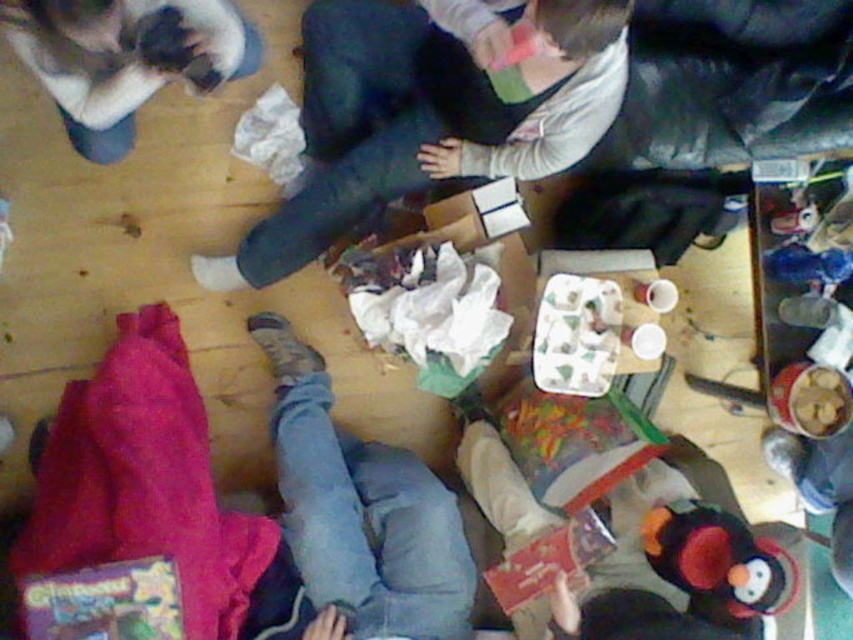
Question: Which point is farther to the camera?

Choices:
 (A) (239, 51)
 (B) (705, 556)
 (C) (527, 24)
 (D) (376, 564)

Answer: (D)

Question: Which object is positioned farthest from the jeans at center?

Choices:
 (A) fluffy plush penguin at lower right
 (B) dark blue jeans at center
 (C) fluffy white cat at upper left

Answer: (C)

Question: Is jeans at center to the left of fluffy white cat at upper left from the viewer's perspective?

Choices:
 (A) no
 (B) yes

Answer: (A)

Question: Which point is farther to the camera?

Choices:
 (A) (686, 561)
 (B) (352, 609)

Answer: (B)

Question: Does jeans at center come behind fluffy white cat at upper left?

Choices:
 (A) no
 (B) yes

Answer: (B)

Question: Can you confirm if jeans at center is positioned below fluffy white cat at upper left?

Choices:
 (A) yes
 (B) no

Answer: (A)